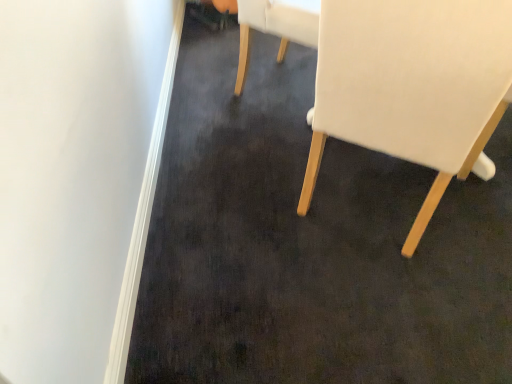
Question: Is white fabric chair at right, placed as the 2th chair when sorted from back to front, aimed at white fabric chair at upper center, which ranks as the second chair in front-to-back order?

Choices:
 (A) yes
 (B) no

Answer: (B)

Question: From the image's perspective, does white fabric chair at right, placed as the 2th chair when sorted from back to front, appear lower than white fabric chair at upper center, which ranks as the second chair in front-to-back order?

Choices:
 (A) yes
 (B) no

Answer: (A)

Question: Is white fabric chair at upper center, arranged as the first chair when viewed from the back, surrounded by white fabric chair at right, which is counted as the first chair, starting from the front?

Choices:
 (A) yes
 (B) no

Answer: (B)

Question: From a real-world perspective, is white fabric chair at right, placed as the 2th chair when sorted from back to front, beneath white fabric chair at upper center, which ranks as the second chair in front-to-back order?

Choices:
 (A) no
 (B) yes

Answer: (A)

Question: Is the position of white fabric chair at right, placed as the 2th chair when sorted from back to front, more distant than that of white fabric chair at upper center, which ranks as the second chair in front-to-back order?

Choices:
 (A) no
 (B) yes

Answer: (A)

Question: Considering the relative sizes of white fabric chair at right, placed as the 2th chair when sorted from back to front, and white fabric chair at upper center, which ranks as the second chair in front-to-back order, in the image provided, is white fabric chair at right, placed as the 2th chair when sorted from back to front, thinner than white fabric chair at upper center, which ranks as the second chair in front-to-back order,?

Choices:
 (A) yes
 (B) no

Answer: (B)

Question: From the image's perspective, is white fabric chair at upper center, arranged as the first chair when viewed from the back, located above white fabric chair at right, which is counted as the first chair, starting from the front?

Choices:
 (A) yes
 (B) no

Answer: (A)

Question: Is the position of white fabric chair at upper center, arranged as the first chair when viewed from the back, more distant than that of white fabric chair at right, placed as the 2th chair when sorted from back to front?

Choices:
 (A) yes
 (B) no

Answer: (A)

Question: From a real-world perspective, is white fabric chair at upper center, arranged as the first chair when viewed from the back, physically above white fabric chair at right, placed as the 2th chair when sorted from back to front?

Choices:
 (A) yes
 (B) no

Answer: (B)

Question: Does white fabric chair at upper center, which ranks as the second chair in front-to-back order, have a larger size compared to white fabric chair at right, placed as the 2th chair when sorted from back to front?

Choices:
 (A) no
 (B) yes

Answer: (A)

Question: Is white fabric chair at upper center, arranged as the first chair when viewed from the back, positioned with its back to white fabric chair at right, placed as the 2th chair when sorted from back to front?

Choices:
 (A) yes
 (B) no

Answer: (B)

Question: Does white fabric chair at upper center, arranged as the first chair when viewed from the back, appear on the right side of white fabric chair at right, placed as the 2th chair when sorted from back to front?

Choices:
 (A) no
 (B) yes

Answer: (A)

Question: From the image's perspective, is white fabric chair at upper center, which ranks as the second chair in front-to-back order, positioned above or below white fabric chair at right, placed as the 2th chair when sorted from back to front?

Choices:
 (A) below
 (B) above

Answer: (B)